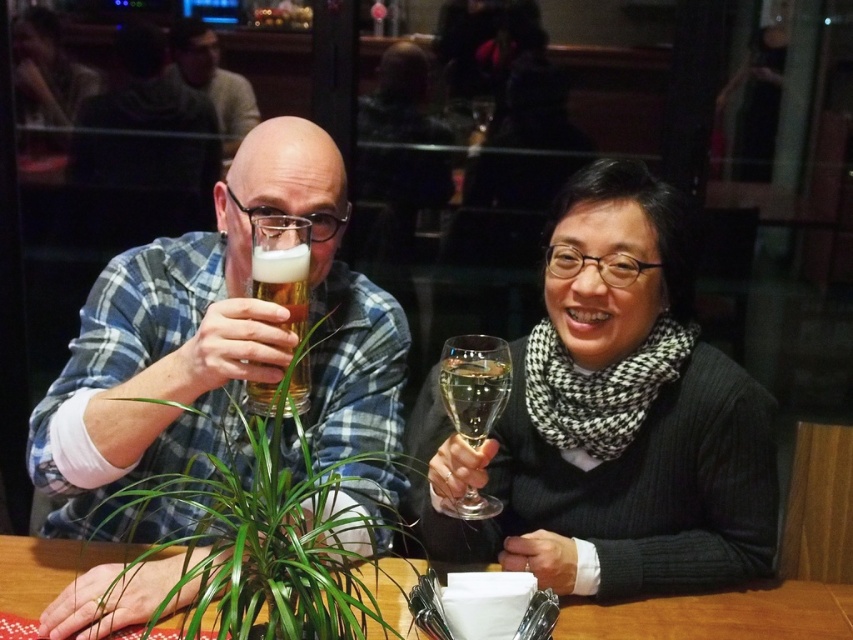
Question: Is black wool scarf at center to the left of foamy golden beer at center from the viewer's perspective?

Choices:
 (A) no
 (B) yes

Answer: (A)

Question: Which object is the closest to the matte black shirt at upper left?

Choices:
 (A) green leafy plant at center
 (B) clear glass wine glass at right

Answer: (A)

Question: Is translucent glass beer at left positioned at the back of clear glass wine glass at right?

Choices:
 (A) yes
 (B) no

Answer: (B)

Question: Which object appears farthest from the camera in this image?

Choices:
 (A) matte black shirt at upper left
 (B) clear glass wine glass at right

Answer: (A)

Question: Which object is positioned closest to the wooden table at center?

Choices:
 (A) clear glass wine glass at right
 (B) matte black shirt at upper left

Answer: (A)

Question: Does translucent glass beer at left appear on the left side of green leafy plant at center?

Choices:
 (A) yes
 (B) no

Answer: (A)